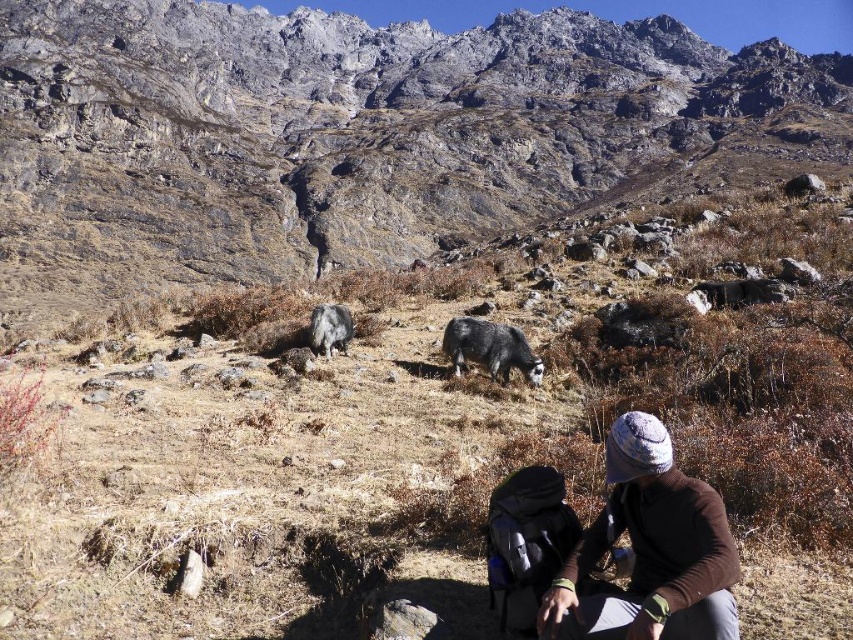
You are a hiker who has just arrived at this mountain location. You notice the brown woolen hat at lower right and the fuzzy gray goat at center. Which object is bigger in size?

The brown woolen hat at lower right is larger in size than the fuzzy gray goat at center.

Based on the photo, you are a hiker who wants to take a photo of the gray rocky mountain at center and the gray woolen yak at center. Which one should you focus on first to ensure both are in the same frame?

You should focus on the gray rocky mountain at center first because it is closer to you than the gray woolen yak at center, allowing both to be in the same frame.